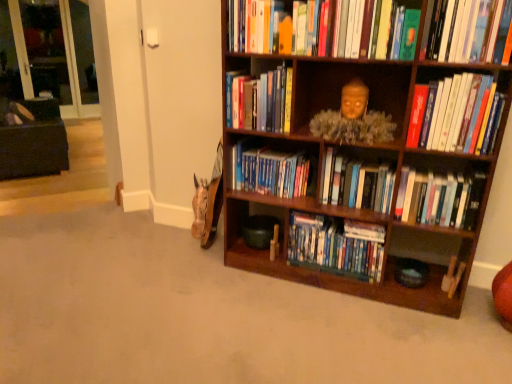
Question: Visually, is dark brown fabric bean bag chair at left positioned to the left or to the right of transparent glass door at upper left, the 1th glass door from the left?

Choices:
 (A) left
 (B) right

Answer: (B)

Question: Looking at their shapes, would you say dark brown fabric bean bag chair at left is wider or thinner than transparent glass door at upper left, the 1th glass door from the left?

Choices:
 (A) wide
 (B) thin

Answer: (A)

Question: Which object is positioned closest to the transparent glass door at upper left, the 1th glass door from the left?

Choices:
 (A) blue hardcover books at center, placed as the 4th book when sorted from top to bottom
 (B) wooden bookshelf at center, the 1th book ordered from the bottom
 (C) hardcover books at center, which is the third book from bottom to top
 (D) hardcover books at upper right, which appears as the 3th book when viewed from the top
 (E) transparent glass door at upper left, the 1th glass door when ordered from right to left

Answer: (E)

Question: Which object is positioned closest to the transparent glass door at upper left, the 1th glass door when ordered from right to left?

Choices:
 (A) transparent glass door at upper left, arranged as the second glass door when viewed from the right
 (B) hardcover books at center, which is counted as the 6th book, starting from the bottom
 (C) hardcover book at upper right, which is counted as the 1th book, starting from the top
 (D) wooden bookcase at right
 (E) wooden statue at upper center

Answer: (A)